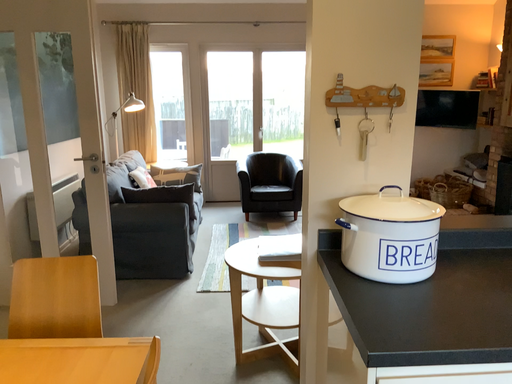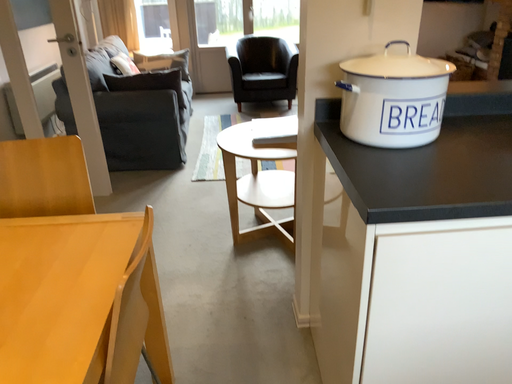
Question: How did the camera likely rotate when shooting the video?

Choices:
 (A) rotated downward
 (B) rotated upward

Answer: (A)